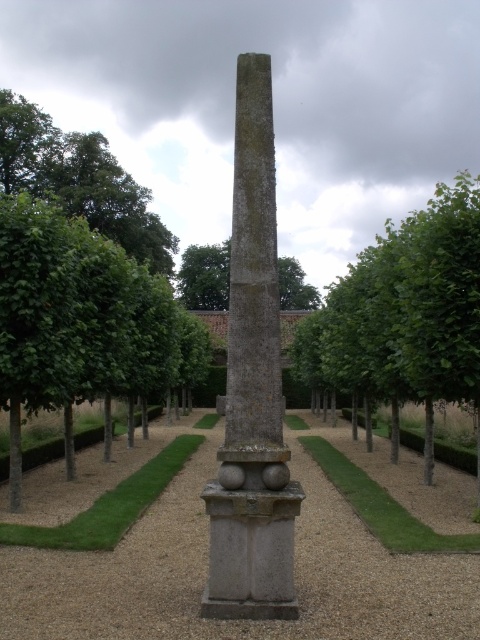
Does gray stone obelisk at center appear under green leafy tree at center?

Yes, gray stone obelisk at center is below green leafy tree at center.

This screenshot has height=640, width=480. Identify the location of gray stone obelisk at center. (252, 388).

You are a GUI agent. You are given a task and a screenshot of the screen. Output one action in this format:
    pyautogui.click(x=<x>, y=<y>)
    Task: Click on the gray stone obelisk at center
    Image resolution: width=480 pixels, height=640 pixels.
    Given the screenshot: What is the action you would take?
    pyautogui.click(x=252, y=388)

Does point (442, 518) come closer to viewer compared to point (2, 227)?

No, it is behind (2, 227).

The image size is (480, 640). Describe the element at coordinates (295, 564) in the screenshot. I see `smooth gravel path at center` at that location.

Between point (356, 618) and point (80, 349), which one is positioned in front?

Point (356, 618) is in front.

Identify the location of smooth gravel path at center. The width and height of the screenshot is (480, 640). (295, 564).

Is smooth gravel path at center to the left of green leafy tree at center from the viewer's perspective?

Indeed, smooth gravel path at center is positioned on the left side of green leafy tree at center.

Is smooth gravel path at center bigger than green leafy tree at center?

No, smooth gravel path at center is not bigger than green leafy tree at center.

Is point (385, 614) closer to camera compared to point (377, 323)?

Yes.

Locate an element on the screen. smooth gravel path at center is located at coordinates (295, 564).